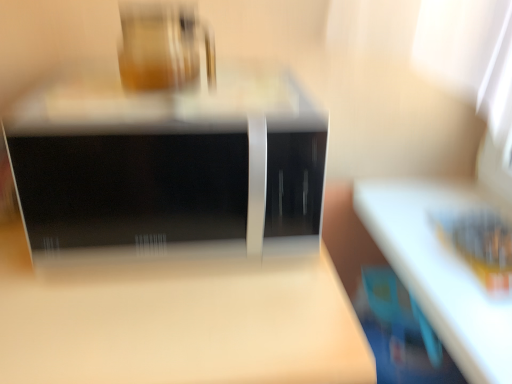
Question: Is matte wood table at center to the left or to the right of matte glass jar at upper center in the image?

Choices:
 (A) right
 (B) left

Answer: (B)

Question: Is point (146, 309) positioned closer to the camera than point (187, 13)?

Choices:
 (A) farther
 (B) closer

Answer: (B)

Question: Estimate the real-world distances between objects in this image. Which object is farther from the black glossy microwave at center?

Choices:
 (A) matte glass jar at upper center
 (B) matte wood table at center

Answer: (B)

Question: Considering the real-world distances, which object is farthest from the matte wood table at center?

Choices:
 (A) black glossy microwave at center
 (B) matte glass jar at upper center

Answer: (B)